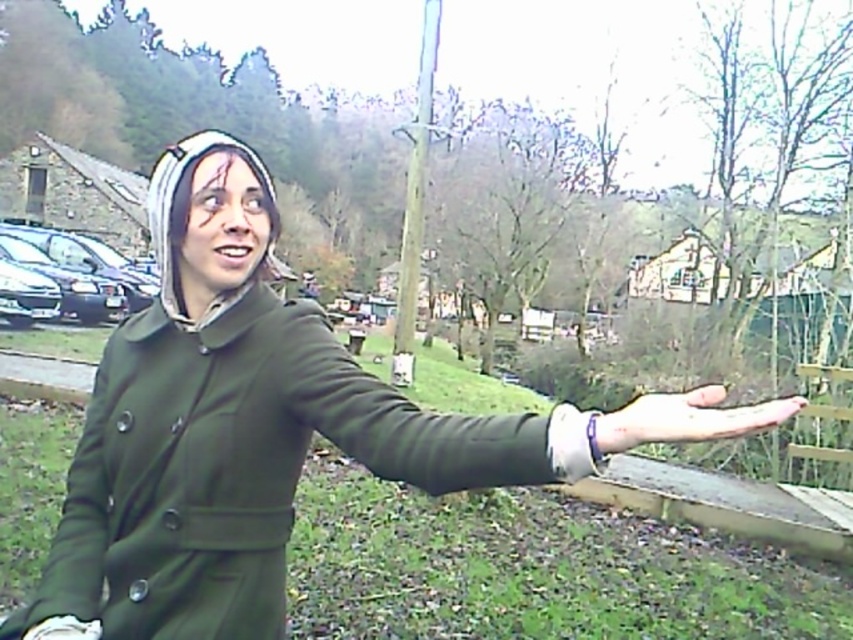
You are a fashion designer observing the image. You need to decide which item to adjust in size to ensure proper proportion between the green matte jacket at center and the smooth skin hand at center. Which object should be made larger?

The green matte jacket at center has a lesser height compared to the smooth skin hand at center, so the green matte jacket at center should be made larger to match the hand size proportionally.

You are a photographer trying to capture the scene from the front. The green fabric arm at center and the smooth skin hand at center are both in your frame. Which object should you adjust your camera to focus on first if you want to ensure both are in focus, considering their positions?

The green fabric arm at center is to the left of smooth skin hand at center, so you should focus on the green fabric arm at center first as it is closer to the left side of the frame to ensure both are in focus.